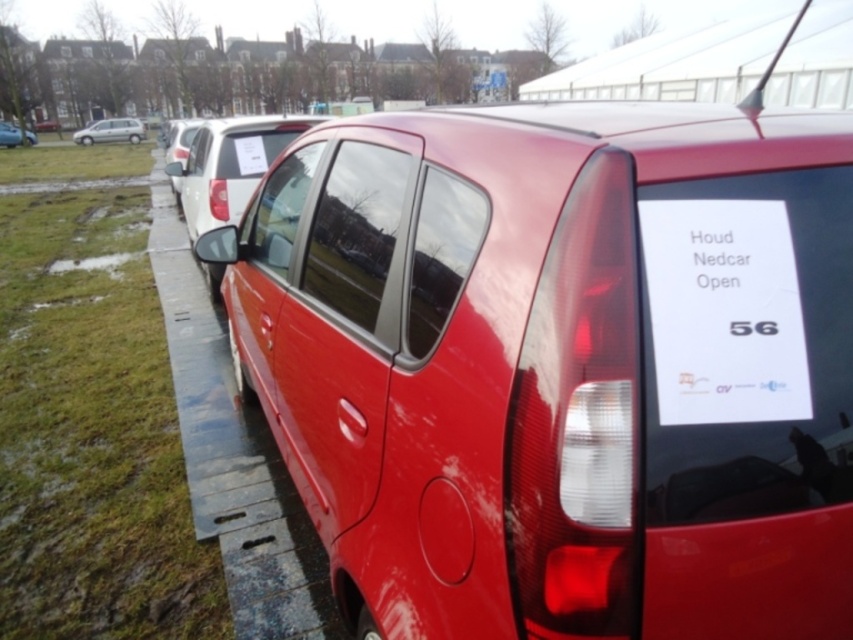
Question: Among these objects, which one is farthest from the camera?

Choices:
 (A) silver metallic van at upper left
 (B) metallic silver car at upper left
 (C) glossy white van at center
 (D) metal curb at lower left

Answer: (A)

Question: Can you confirm if metal curb at lower left is bigger than metallic silver car at upper left?

Choices:
 (A) no
 (B) yes

Answer: (B)

Question: Which point is closer to the camera?

Choices:
 (A) metal curb at lower left
 (B) silver metallic van at upper left
 (C) metallic silver car at upper left

Answer: (A)

Question: Does silver metallic van at upper left have a larger size compared to metallic silver car at upper left?

Choices:
 (A) yes
 (B) no

Answer: (B)

Question: Which object is positioned farthest from the glossy white van at center?

Choices:
 (A) metallic silver car at upper left
 (B) metal curb at lower left

Answer: (A)

Question: Can you confirm if silver metallic van at upper left is thinner than metallic silver car at upper left?

Choices:
 (A) no
 (B) yes

Answer: (B)